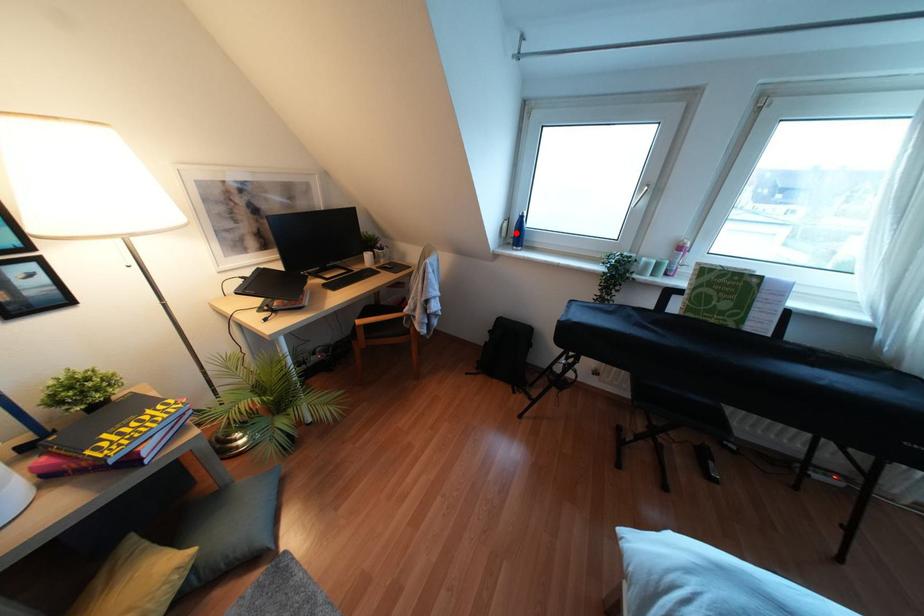
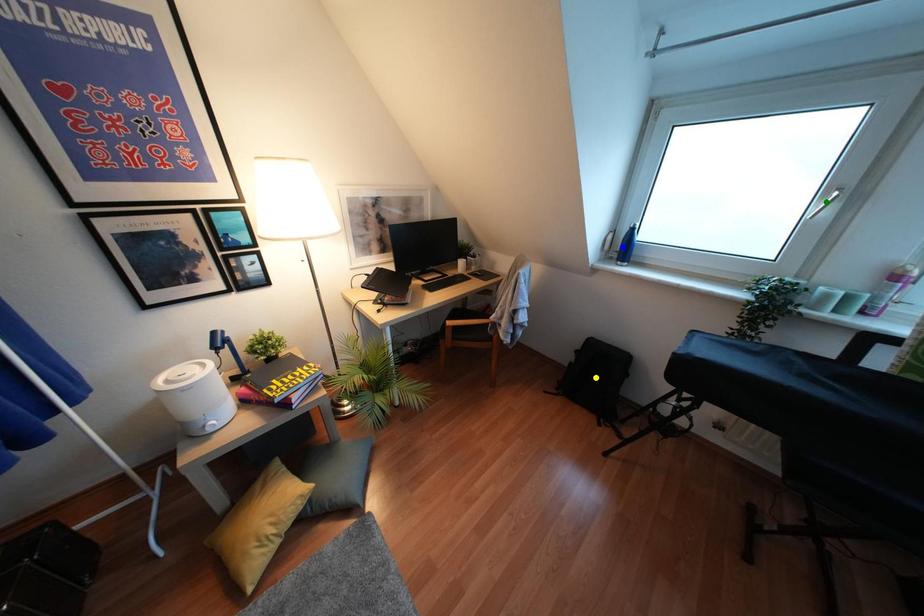
Question: I am providing you with two images of the same scene from different viewpoints. A red point is marked on the first image. You are given multiple points on the second image. Which point in image 2 is actually the same real-world point as the red point in image 1?

Choices:
 (A) yellow point
 (B) blue point
 (C) green point

Answer: (B)